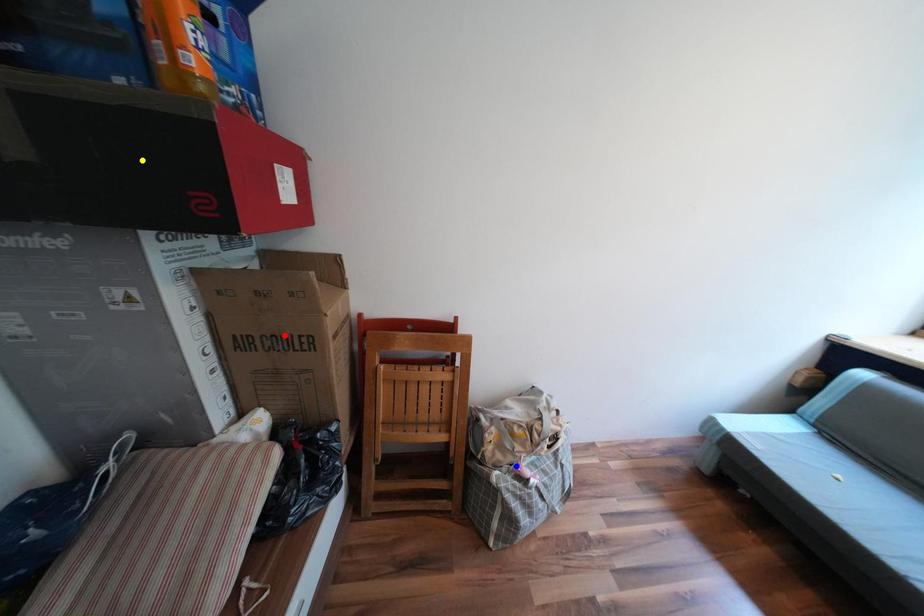
Order these from nearest to farthest:
yellow point
red point
blue point

1. blue point
2. red point
3. yellow point